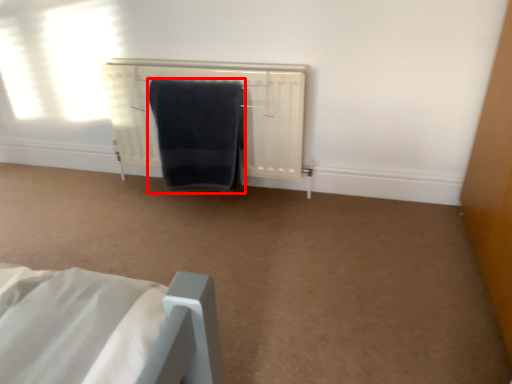
Question: In this image, where is towel (annotated by the red box) located relative to radiator?

Choices:
 (A) right
 (B) left

Answer: (B)